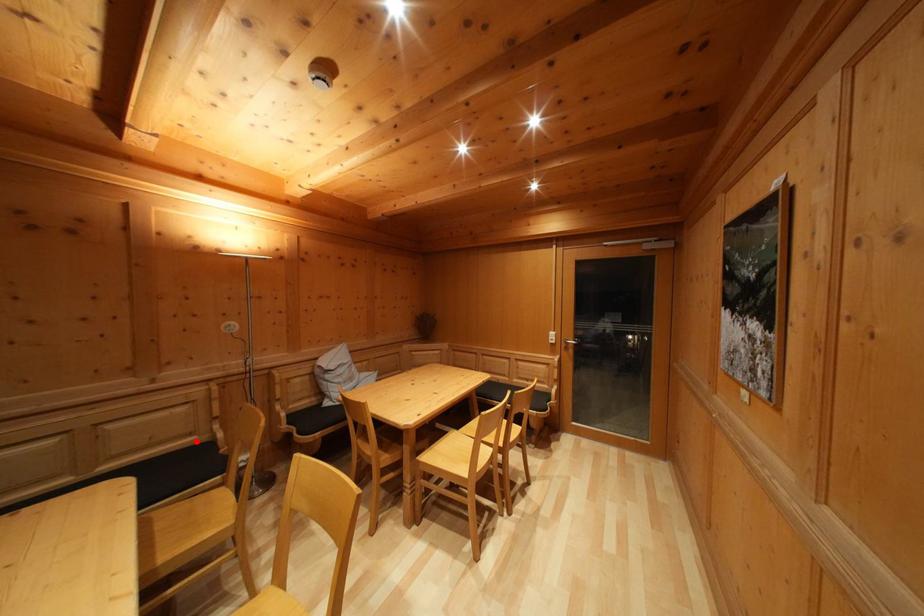
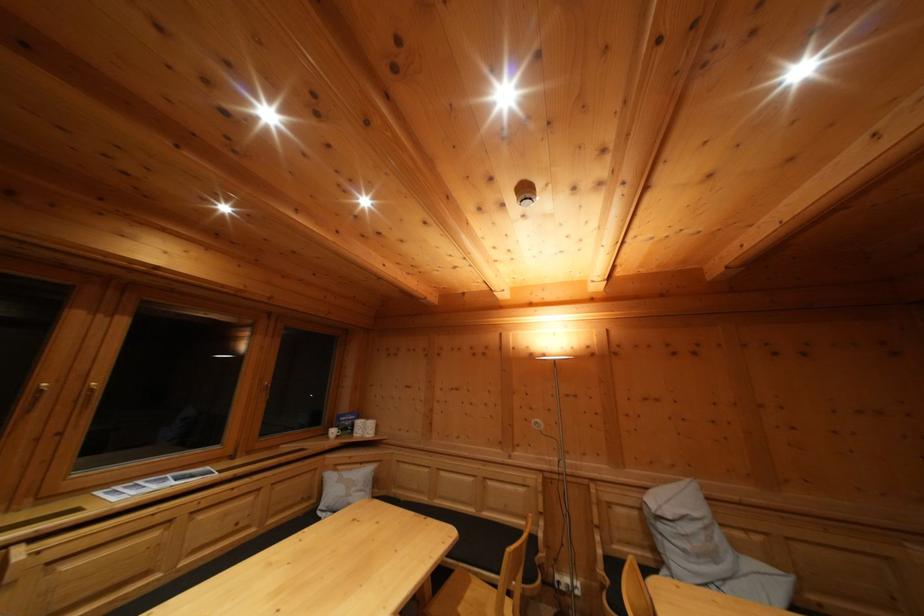
Question: I am providing you with two images of the same scene from different viewpoints. Given a red point in image1, look at the same physical point in image2. Is it:

Choices:
 (A) Closer to the viewpoint
 (B) Farther from the viewpoint

Answer: (B)